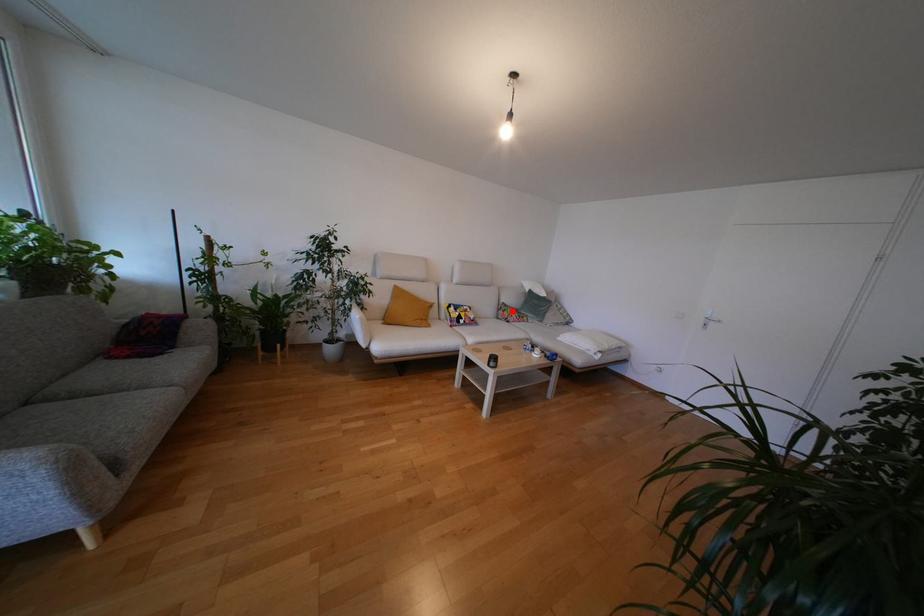
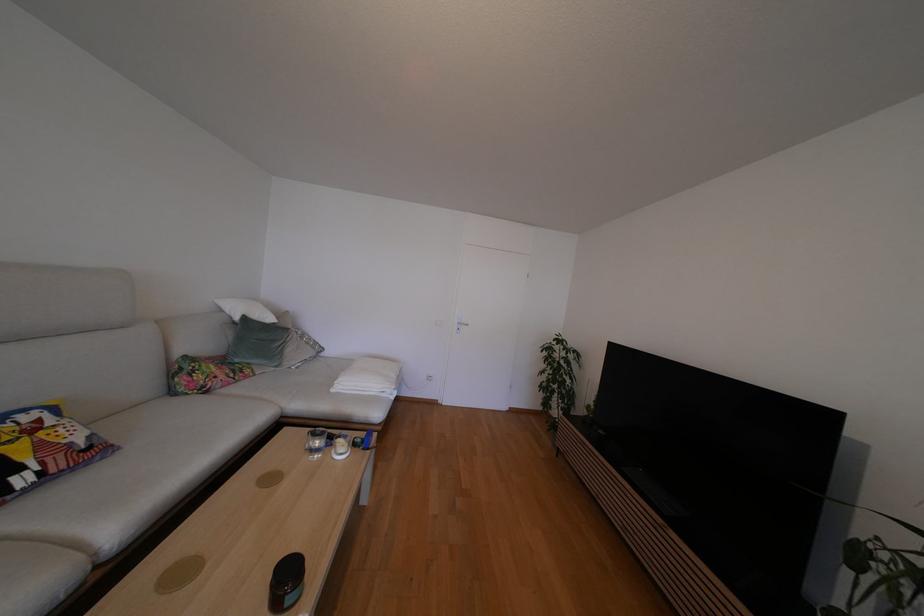
Where in the second image is the point corresponding to the highlighted location from the first image?

(207, 368)